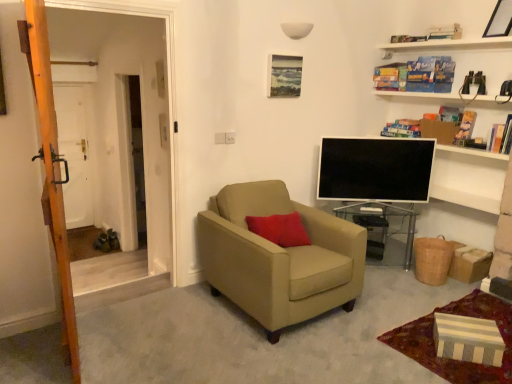
I want to click on free point to the right of beige fabric armchair at center, so click(387, 302).